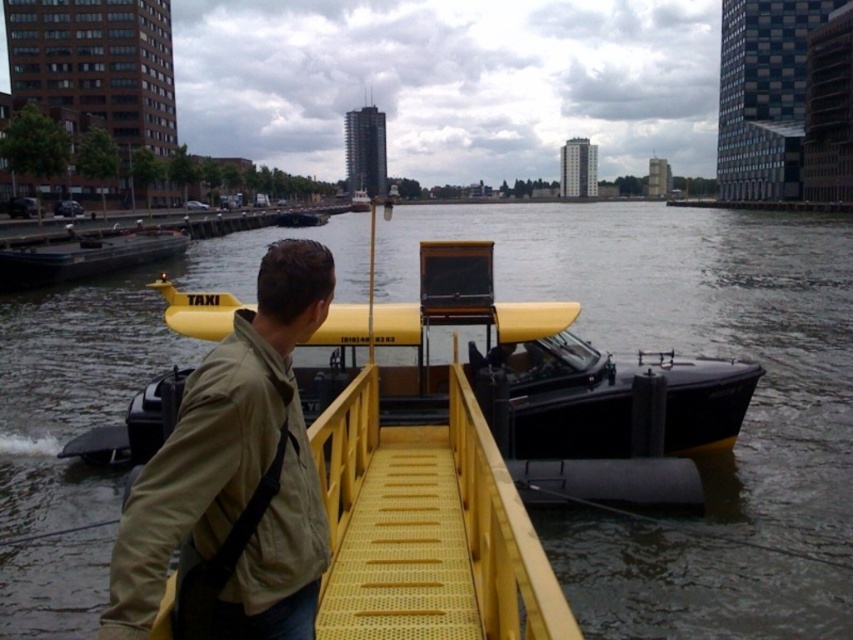
Question: Can you confirm if smooth water at center is positioned below yellow matte taxi boat at center?

Choices:
 (A) yes
 (B) no

Answer: (B)

Question: Estimate the real-world distances between objects in this image. Which object is farther from the smooth water at center?

Choices:
 (A) khaki fabric jacket at center
 (B) yellow matte taxi boat at center

Answer: (A)

Question: Can you confirm if smooth water at center is smaller than yellow matte taxi boat at center?

Choices:
 (A) no
 (B) yes

Answer: (A)

Question: Which point appears closest to the camera in this image?

Choices:
 (A) (614, 266)
 (B) (123, 564)

Answer: (B)

Question: Is smooth water at center thinner than yellow matte taxi boat at center?

Choices:
 (A) no
 (B) yes

Answer: (A)

Question: Which object appears closest to the camera in this image?

Choices:
 (A) smooth water at center
 (B) yellow matte taxi boat at center
 (C) khaki fabric jacket at center

Answer: (C)